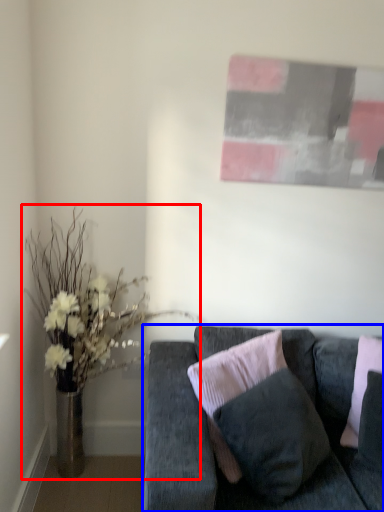
Question: Which object appears farthest to the camera in this image, houseplant (highlighted by a red box) or studio couch (highlighted by a blue box)?

Choices:
 (A) houseplant
 (B) studio couch

Answer: (A)